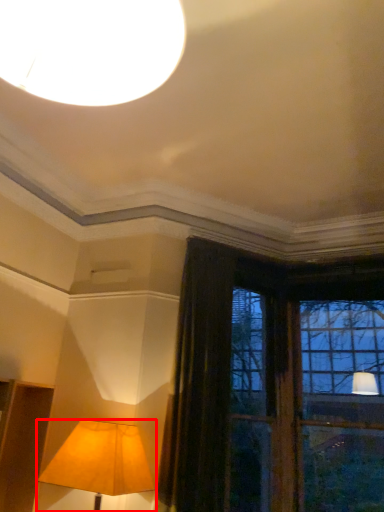
Question: From the image's perspective, what is the correct spatial positioning of lamp (annotated by the red box) in reference to curtain?

Choices:
 (A) below
 (B) above

Answer: (A)